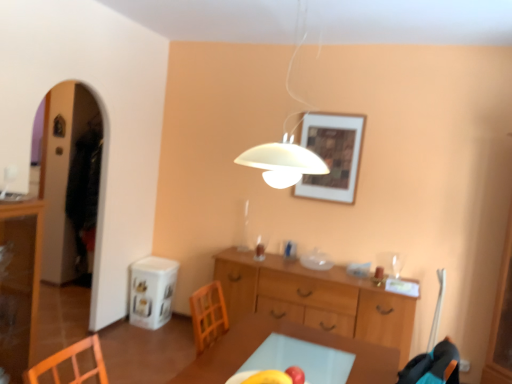
Question: Is wooden framed artwork at upper center wider or thinner than white matte lampshade at upper center?

Choices:
 (A) wide
 (B) thin

Answer: (B)

Question: Is wooden framed artwork at upper center spatially inside white matte lampshade at upper center, or outside of it?

Choices:
 (A) outside
 (B) inside

Answer: (A)

Question: Which object is positioned closest to the light brown wooden table at center?

Choices:
 (A) yellow matte apple at center
 (B) wooden framed artwork at upper center
 (C) white matte lampshade at upper center
 (D) transparent glass cabinet at left
 (E) wooden cabinet at center

Answer: (A)

Question: Which is nearer to the wooden cabinet at center?

Choices:
 (A) yellow matte apple at center
 (B) white matte lampshade at upper center
 (C) transparent glass cabinet at left
 (D) wooden framed artwork at upper center
 (E) light brown wooden table at center

Answer: (D)